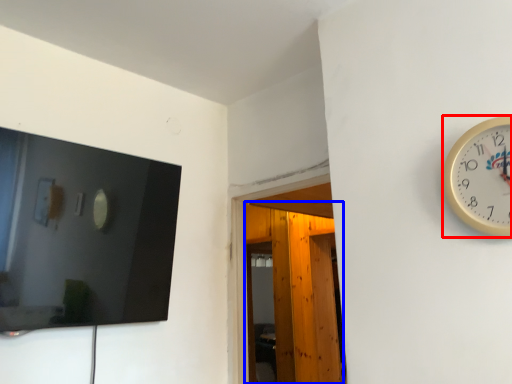
Question: Which object is further to the camera taking this photo, wall clock (highlighted by a red box) or glass door (highlighted by a blue box)?

Choices:
 (A) wall clock
 (B) glass door

Answer: (B)